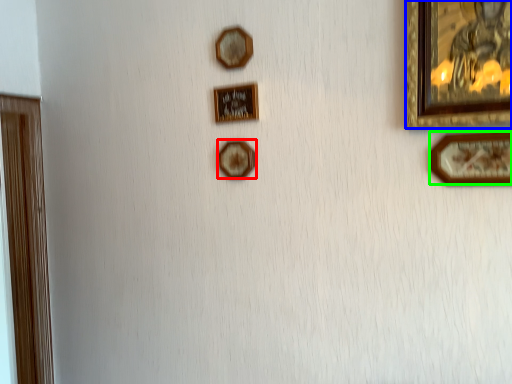
Question: Which object is the farthest from picture frame (highlighted by a red box)? Choose among these: picture frame (highlighted by a blue box) or picture frame (highlighted by a green box).

Choices:
 (A) picture frame
 (B) picture frame

Answer: (A)